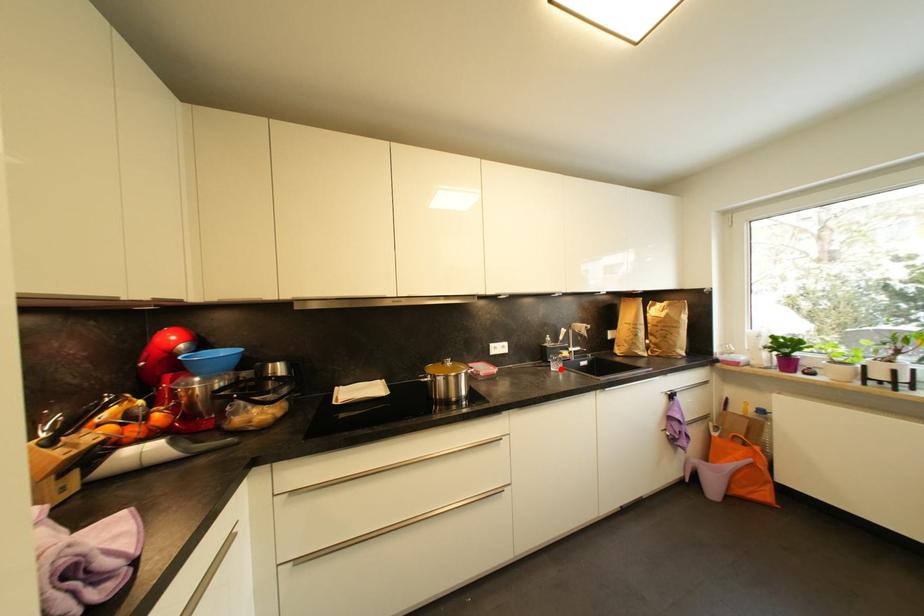
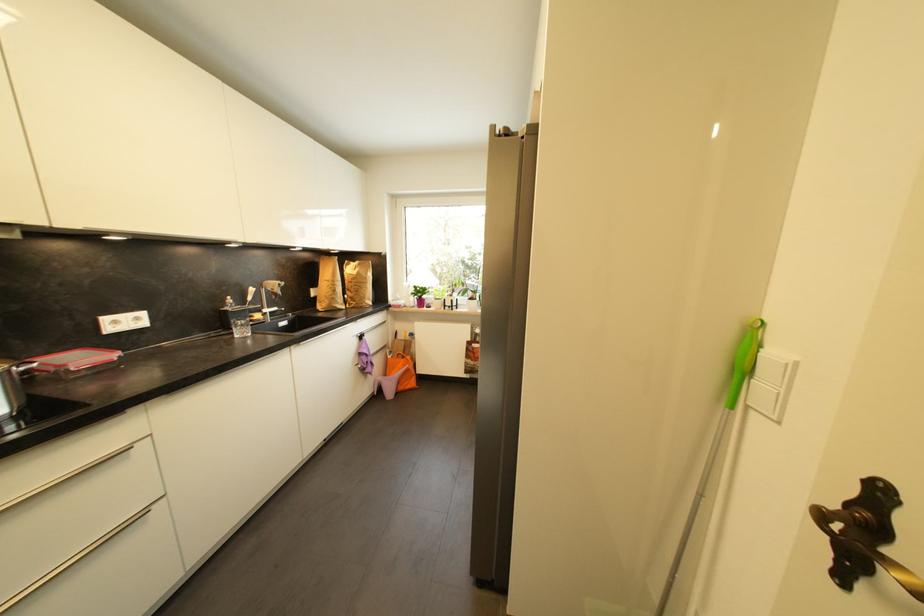
In the second image, find the point that corresponds to the highlighted location in the first image.

(247, 334)